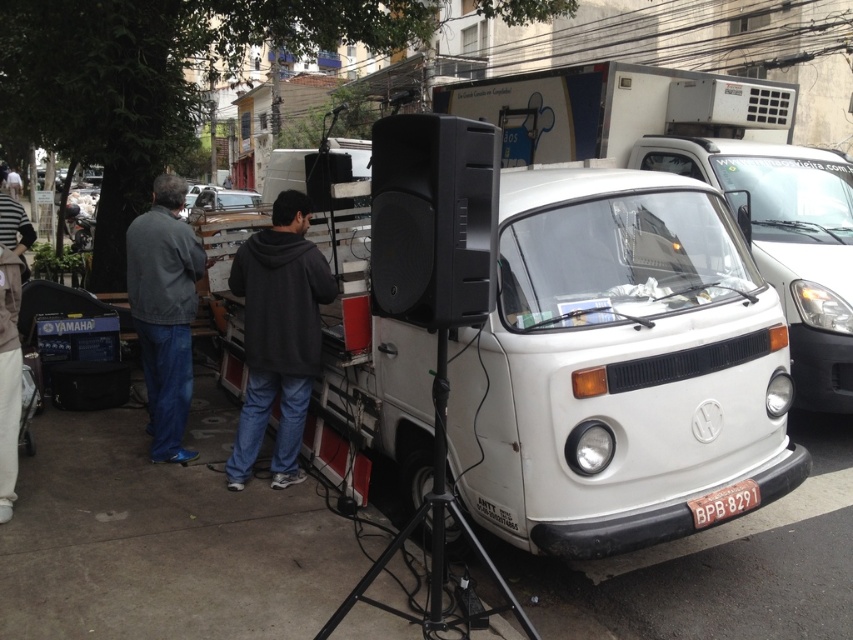
Which is more to the right, white matte van at center or black metal tripod at center?

Positioned to the right is white matte van at center.

Can you confirm if white matte van at center is taller than black metal tripod at center?

In fact, white matte van at center may be shorter than black metal tripod at center.

Between point (795, 225) and point (462, 525), which one is positioned in front?

Point (462, 525) is more forward.

Where is `white matte van at center`? The height and width of the screenshot is (640, 853). white matte van at center is located at coordinates (705, 177).

Which is above, dark gray hoodie at center or dark gray jacket at left?

dark gray jacket at left

The image size is (853, 640). What do you see at coordinates (277, 336) in the screenshot?
I see `dark gray hoodie at center` at bounding box center [277, 336].

At what (x,y) coordinates should I click in order to perform the action: click on dark gray hoodie at center. Please return your answer as a coordinate pair (x, y). The height and width of the screenshot is (640, 853). Looking at the image, I should click on (277, 336).

Between point (500, 579) and point (257, 193), which one is positioned in front?

Point (500, 579)

Is black metal tripod at center to the right of metallic silver car at center from the viewer's perspective?

Correct, you'll find black metal tripod at center to the right of metallic silver car at center.

Identify the location of black metal tripod at center. (434, 538).

The image size is (853, 640). I want to click on black metal tripod at center, so click(434, 538).